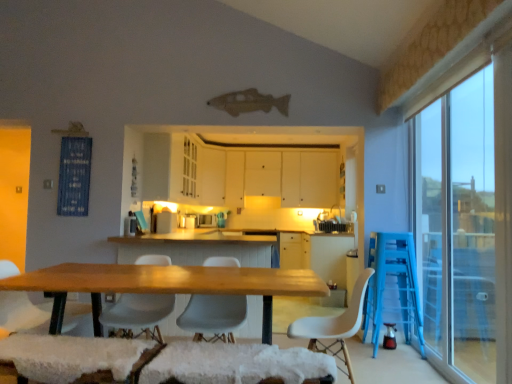
Question: Is the position of white matte cabinets at center, which is counted as the second cabinetry, starting from the back, more distant than that of white matte chair at center, which appears as the second chair when viewed from the left?

Choices:
 (A) yes
 (B) no

Answer: (A)

Question: Is white matte cabinets at center, which is counted as the second cabinetry, starting from the back, at the left side of white matte chair at center, which appears as the second chair when viewed from the left?

Choices:
 (A) yes
 (B) no

Answer: (B)

Question: Can you confirm if white matte cabinets at center, the first cabinetry from the front, is smaller than white matte chair at center, which appears as the 3th chair when viewed from the right?

Choices:
 (A) no
 (B) yes

Answer: (A)

Question: From the image's perspective, would you say white matte cabinets at center, which is counted as the second cabinetry, starting from the back, is positioned over white matte chair at center, which appears as the second chair when viewed from the left?

Choices:
 (A) no
 (B) yes

Answer: (B)

Question: Are white matte cabinets at center, the first cabinetry from the front, and white matte chair at center, which appears as the second chair when viewed from the left, beside each other?

Choices:
 (A) yes
 (B) no

Answer: (B)

Question: Could you tell me if white matte cabinets at center, which is counted as the second cabinetry, starting from the back, is turned towards white matte chair at center, which appears as the second chair when viewed from the left?

Choices:
 (A) no
 (B) yes

Answer: (A)

Question: Considering the relative positions of white matte chair at center, which appears as the second chair when viewed from the left, and white matte cabinets at center, which is counted as the second cabinetry, starting from the back, in the image provided, is white matte chair at center, which appears as the second chair when viewed from the left, behind white matte cabinets at center, which is counted as the second cabinetry, starting from the back,?

Choices:
 (A) no
 (B) yes

Answer: (A)

Question: Is white matte chair at center, which appears as the second chair when viewed from the left, positioned with its back to white matte cabinets at center, the first cabinetry from the front?

Choices:
 (A) yes
 (B) no

Answer: (A)

Question: From a real-world perspective, is white matte chair at center, which appears as the 3th chair when viewed from the right, positioned over white matte cabinets at center, the first cabinetry from the front, based on gravity?

Choices:
 (A) no
 (B) yes

Answer: (A)

Question: Are white matte chair at center, which appears as the second chair when viewed from the left, and white matte cabinets at center, which is counted as the second cabinetry, starting from the back, beside each other?

Choices:
 (A) no
 (B) yes

Answer: (A)

Question: Can we say white matte chair at center, which appears as the second chair when viewed from the left, lies outside white matte cabinets at center, which is counted as the second cabinetry, starting from the back?

Choices:
 (A) no
 (B) yes

Answer: (B)

Question: From the image's perspective, is white matte chair at center, which appears as the second chair when viewed from the left, beneath white matte cabinets at center, which is counted as the second cabinetry, starting from the back?

Choices:
 (A) no
 (B) yes

Answer: (B)

Question: Does white fabric chair at lower left, arranged as the fourth chair when viewed from the right, have a greater height compared to white plastic chair at center, arranged as the 1th chair when viewed from the right?

Choices:
 (A) yes
 (B) no

Answer: (A)